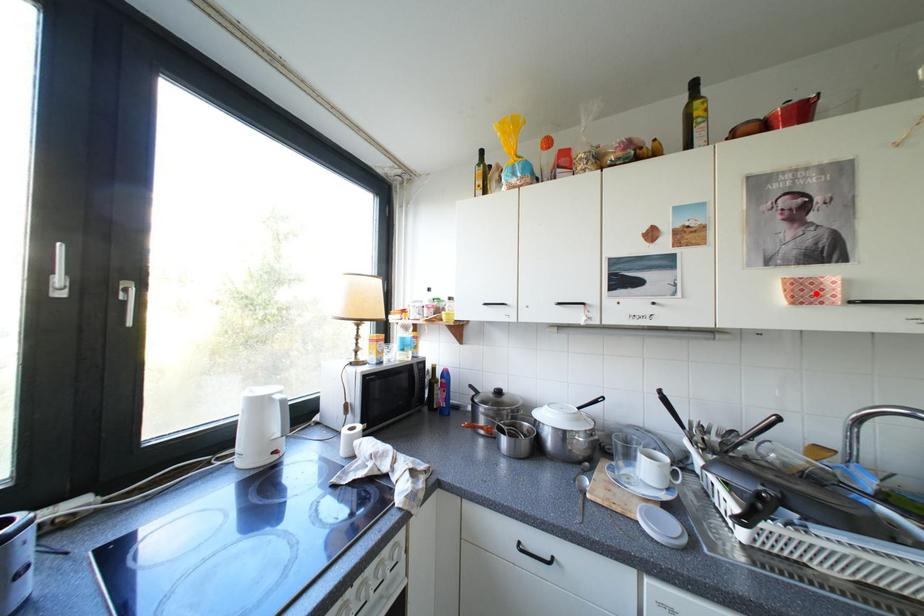
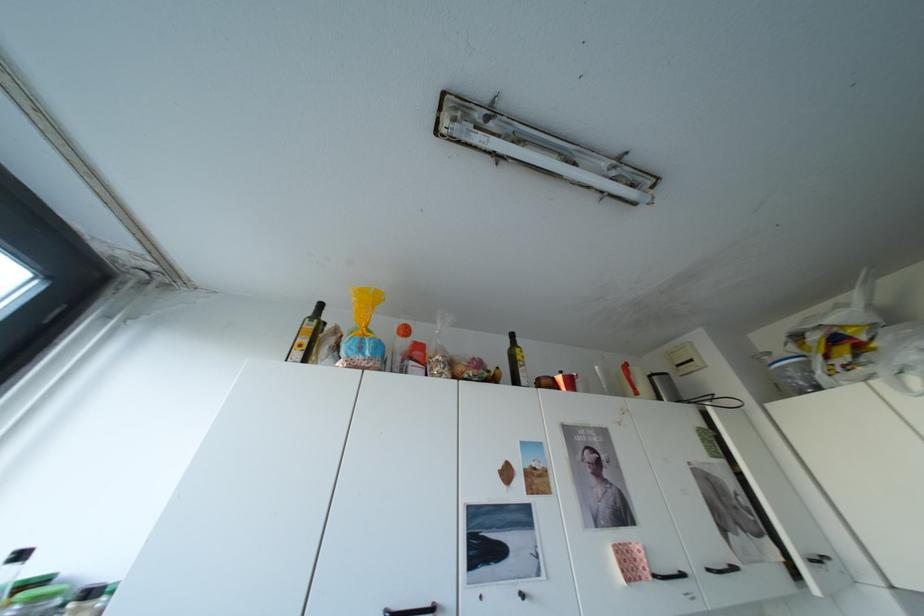
Find the pixel in the second image that matches the highlighted location in the first image.

(642, 568)